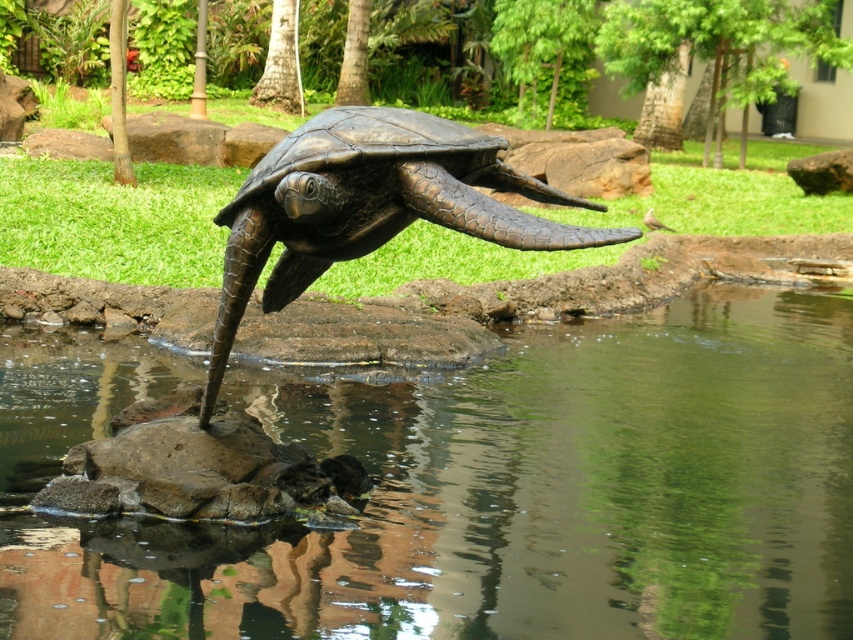
Between transparent water at rock center and bronze textured tortoise at center, which one appears on the right side from the viewer's perspective?

bronze textured tortoise at center is more to the right.

Does transparent water at rock center have a larger size compared to bronze textured tortoise at center?

Correct, transparent water at rock center is larger in size than bronze textured tortoise at center.

The height and width of the screenshot is (640, 853). What do you see at coordinates (518, 496) in the screenshot? I see `transparent water at rock center` at bounding box center [518, 496].

Find the location of a particular element. The height and width of the screenshot is (640, 853). transparent water at rock center is located at coordinates (518, 496).